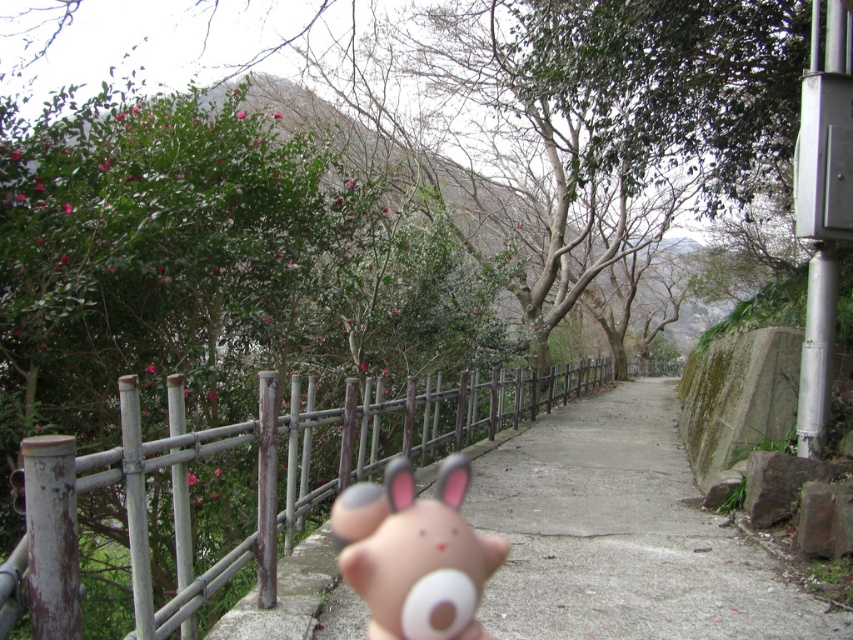
You are standing on the walkway and see the concrete at center and the matte plastic toy at center. Which object is closer to the wooden fence on the left side?

The matte plastic toy at center is closer to the wooden fence on the left side because the concrete at center is positioned on its right side.

You are a delivery robot with a width of 0.5 meters. You need to navigate through the concrete at center while avoiding the matte plastic toy at center. Is there enough space for you to pass safely?

The concrete at center might be wider than matte plastic toy at center, so there might be enough space for the robot to pass safely if the concrete is indeed wider. However, the exact width difference isn not specified, so caution is advised.

You are a photographer trying to capture the wooden fence at center and the matte plastic toy at center in the same frame. Based on their positions, which object should you focus on first to ensure both are in sharp focus?

You should focus on the wooden fence at center first since it is closer to the viewer than the matte plastic toy at center, ensuring both will be in focus when using a shallow depth of field.